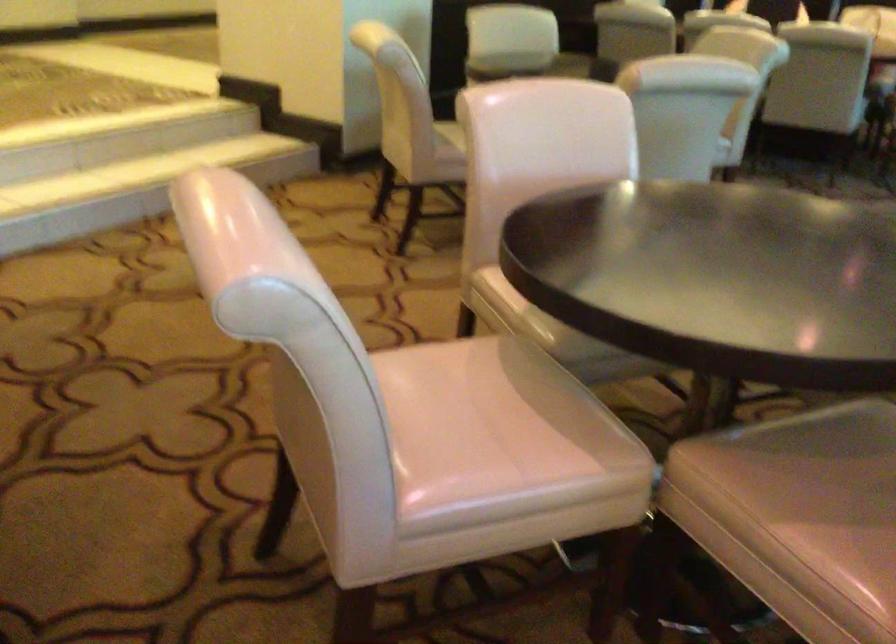
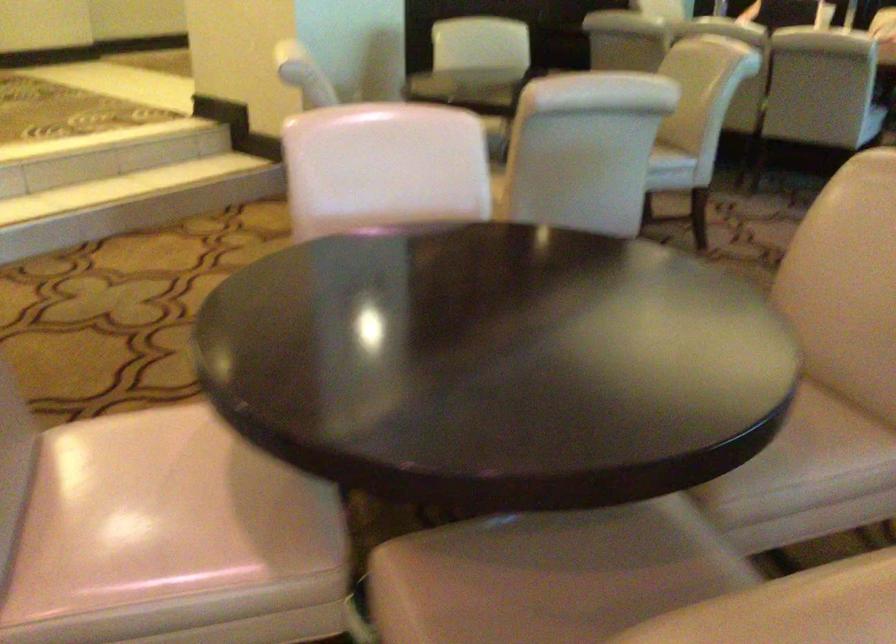
Find the pixel in the second image that matches the point at 426,400 in the first image.

(135, 476)